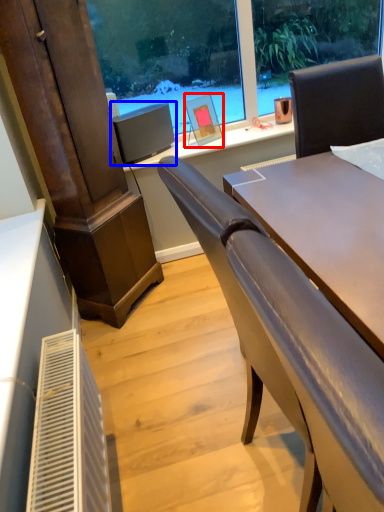
Question: Among these objects, which one is farthest to the camera, picture frame (highlighted by a red box) or computer monitor (highlighted by a blue box)?

Choices:
 (A) picture frame
 (B) computer monitor

Answer: (A)